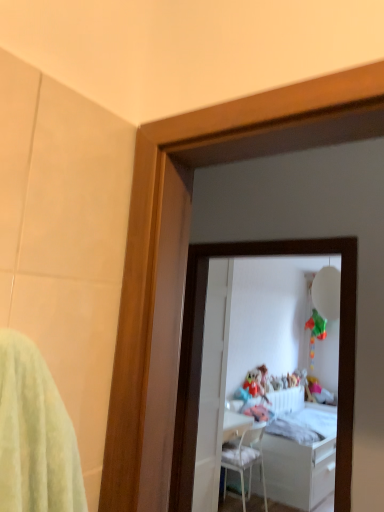
Where is `free point above white glossy mirror at center (from a real-world perspective)`? free point above white glossy mirror at center (from a real-world perspective) is located at coordinates (261, 234).